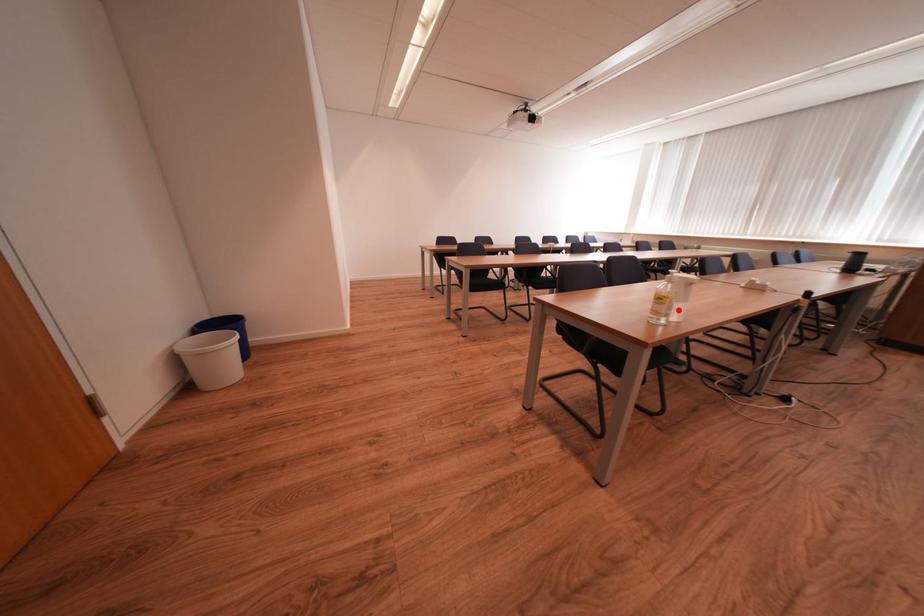
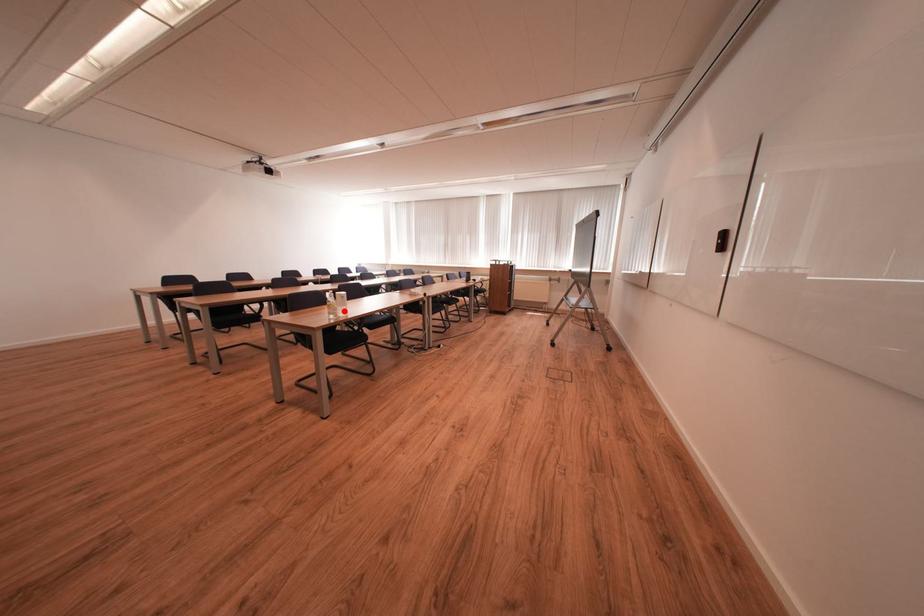
I am providing you with two images of the same scene from different viewpoints. A red point is marked on the first image and another point is marked on the second image. Does the point marked in image1 correspond to the same location as the one in image2?

Yes